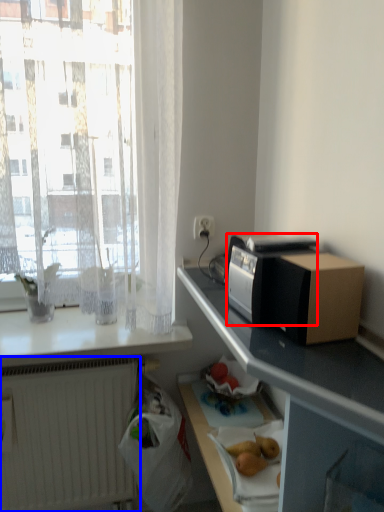
Question: Which of the following is the closest to the observer, appliance (highlighted by a red box) or radiator (highlighted by a blue box)?

Choices:
 (A) appliance
 (B) radiator

Answer: (A)